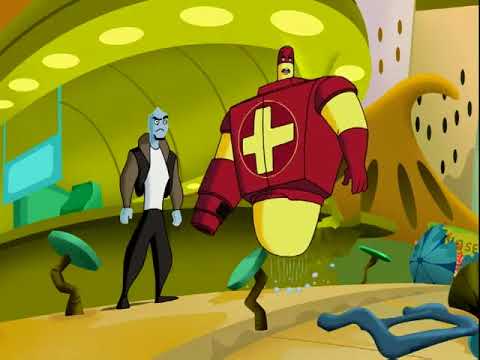
You are a GUI agent. You are given a task and a screenshot of the screen. Output one action in this format:
    pyautogui.click(x=<x>, y=<y>)
    Task: Click on the chair
    Image resolution: width=480 pixels, height=360 pixels.
    Given the screenshot: What is the action you would take?
    pyautogui.click(x=73, y=249)